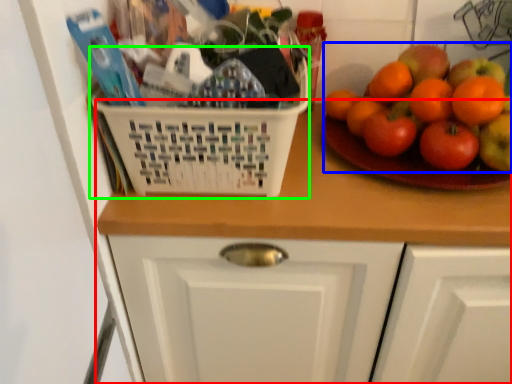
Question: Considering the real-world distances, which object is farthest from counter (highlighted by a red box)? fruit (highlighted by a blue box) or basket (highlighted by a green box)?

Choices:
 (A) fruit
 (B) basket

Answer: (A)